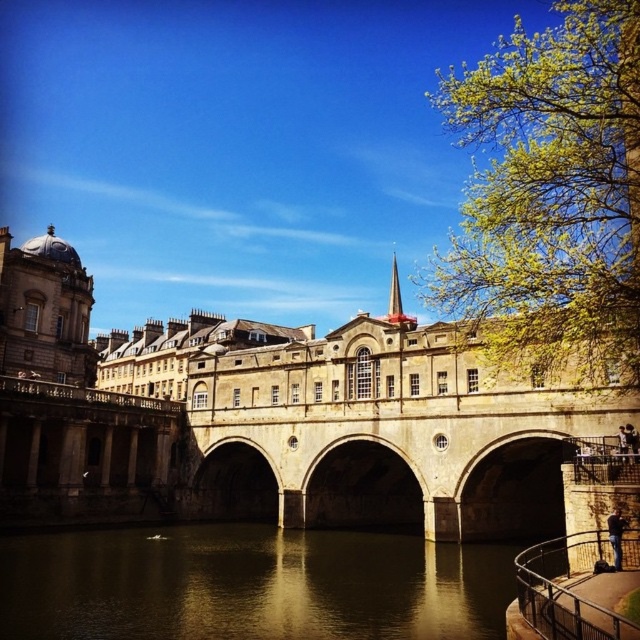
The image size is (640, 640). I want to click on stone bridge at center, so click(x=280, y=424).

Does stone bridge at center come in front of greenish reflective water at center?

No, stone bridge at center is behind greenish reflective water at center.

Is point (317, 387) behind point (464, 548)?

Yes, point (317, 387) is behind point (464, 548).

Locate an element on the screen. stone bridge at center is located at coordinates (280, 424).